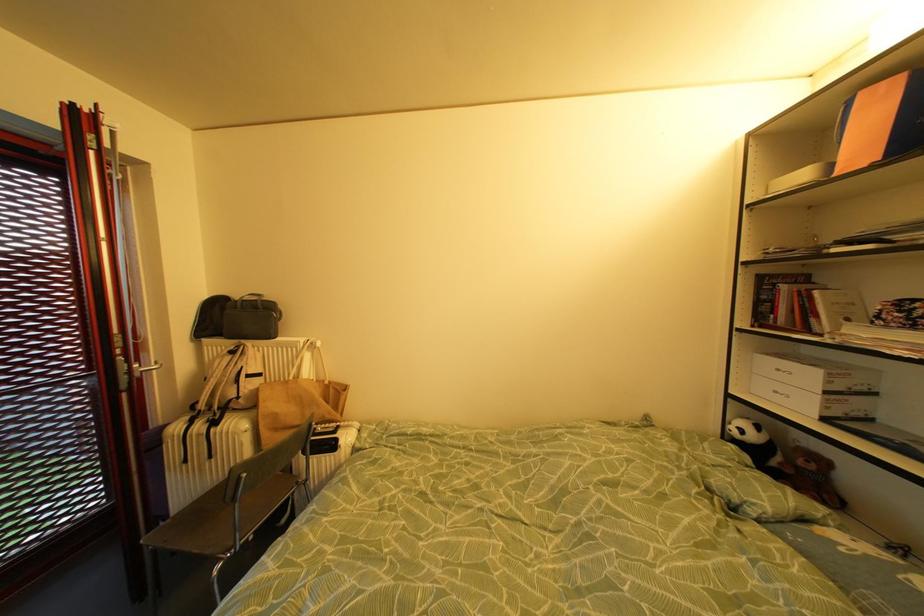
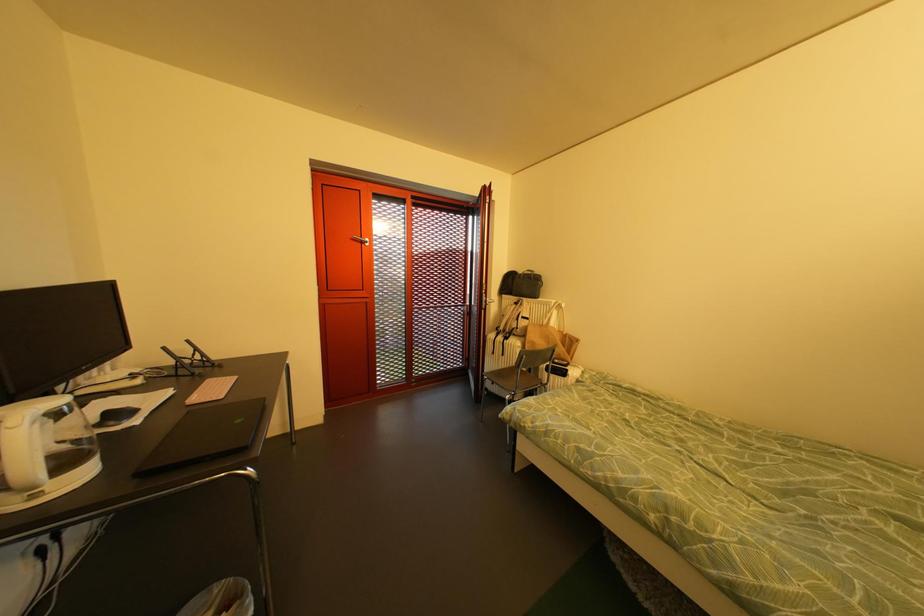
Question: Based on the continuous images, in which direction is the camera rotating? Reply with the corresponding letter.

Choices:
 (A) Left
 (B) Right
 (C) Up
 (D) Down

Answer: (A)